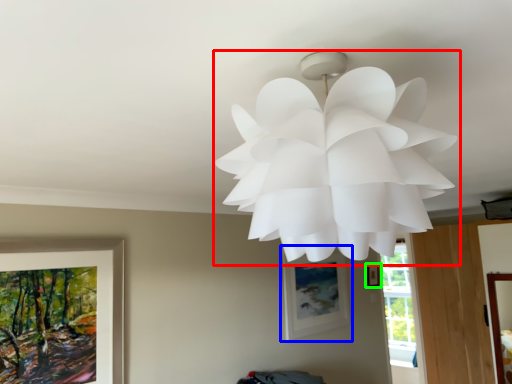
Question: Considering the real-world distances, which object is farthest from lamp (highlighted by a red box)? picture frame (highlighted by a blue box) or picture frame (highlighted by a green box)?

Choices:
 (A) picture frame
 (B) picture frame

Answer: (B)